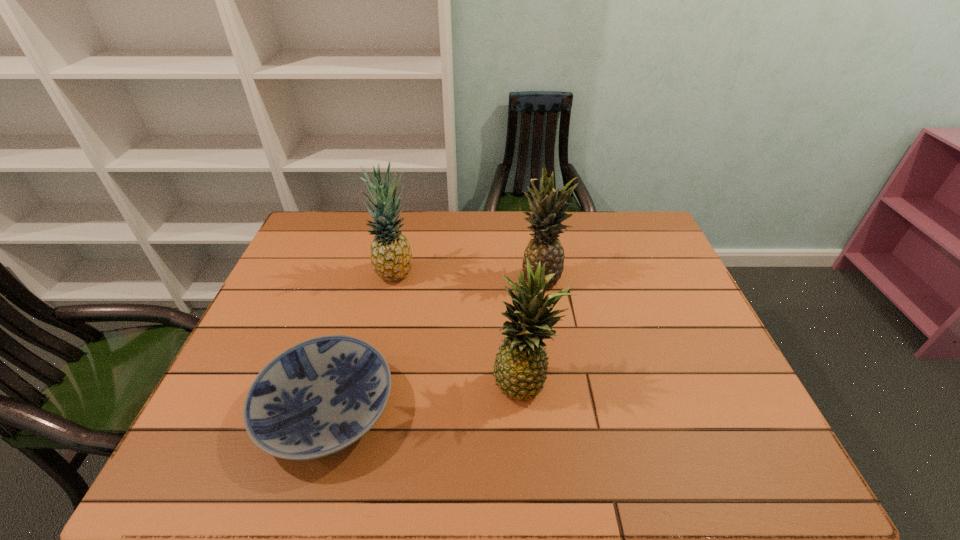
Where is `the leftmost pineapple`? the leftmost pineapple is located at coordinates (391, 257).

This screenshot has height=540, width=960. Find the location of `the nearest pineapple`. the nearest pineapple is located at coordinates (520, 368).

This screenshot has height=540, width=960. Identify the location of the shortest object. (318, 397).

You are a GUI agent. You are given a task and a screenshot of the screen. Output one action in this format:
    pyautogui.click(x=<x>, y=<y>)
    Task: Click on the free location located 0.160m on the back of the leftmost pineapple
    
    Given the screenshot: What is the action you would take?
    pyautogui.click(x=404, y=230)

Identify the location of blank area located on the back of the nearest pineapple. Image resolution: width=960 pixels, height=540 pixels. (520, 321).

Where is `blank space located on the right of the plate`? This screenshot has height=540, width=960. blank space located on the right of the plate is located at coordinates (536, 410).

This screenshot has width=960, height=540. In order to click on object located at the near edge in this screenshot , I will do `click(318, 397)`.

The height and width of the screenshot is (540, 960). Find the location of `object at the left edge`. object at the left edge is located at coordinates (318, 397).

Identify the location of object positioned at the near left corner. (318, 397).

This screenshot has height=540, width=960. I want to click on free location at the far edge, so pos(444,234).